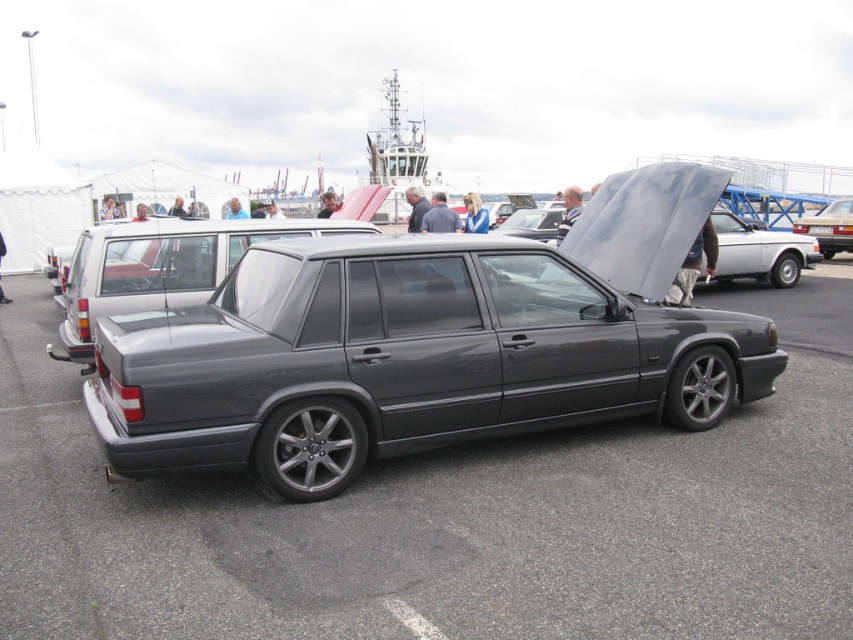
Question: Which of the following is the farthest from the observer?

Choices:
 (A) satin black car at center
 (B) matte gray minivan at center

Answer: (B)

Question: Among these points, which one is nearest to the camera?

Choices:
 (A) (817, 216)
 (B) (491, 408)
 (C) (813, 230)
 (D) (91, 230)

Answer: (B)

Question: Does satin black car at center have a greater width compared to satin black minivan at center?

Choices:
 (A) no
 (B) yes

Answer: (B)

Question: Does satin black minivan at center have a smaller size compared to white plastic license plate at center?

Choices:
 (A) no
 (B) yes

Answer: (A)

Question: Where is satin black minivan at center located in relation to matte gray minivan at center in the image?

Choices:
 (A) below
 (B) above

Answer: (A)

Question: Which point is farther to the camera?

Choices:
 (A) (817, 232)
 (B) (32, 563)
 (C) (814, 234)

Answer: (C)